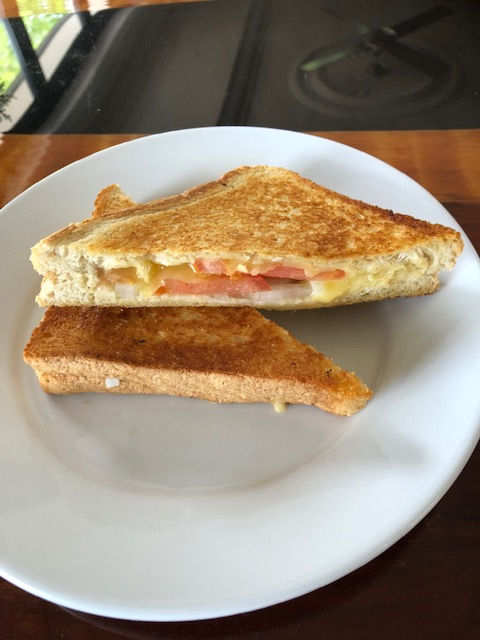
Locate an element on the screen. Image resolution: width=480 pixels, height=640 pixels. the top of white plate is located at coordinates (232, 128).